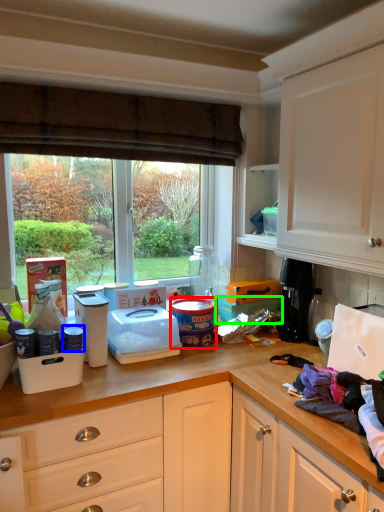
Question: Based on their relative distances, which object is nearer to appliance (highlighted by a red box)? Choose from appliance (highlighted by a blue box) and box (highlighted by a green box).

Choices:
 (A) appliance
 (B) box

Answer: (B)